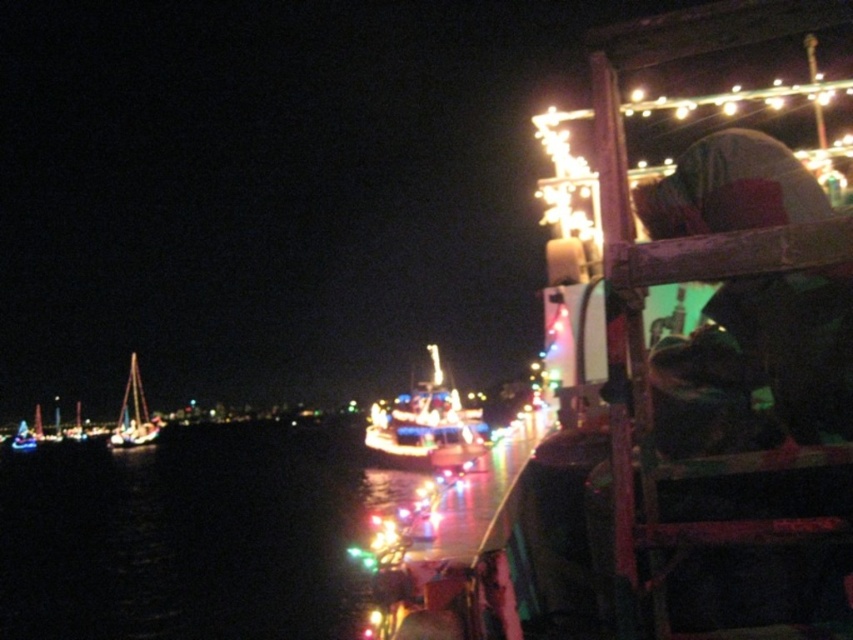
Looking at this image, you are standing at the point with coordinates point (132, 413). What object are you standing on?

You are standing on the shiny silver sailboat at left.

You are standing on the dock and looking out at the scene. Which object, the black water at center or the shiny blue boat at center, is closer to you?

The black water at center is closer to you because the shiny blue boat at center is positioned behind it.

Looking at this image, you are standing on the dock at the marina at night. You see a point marked at coordinates (186, 536). What is located at that point?

The point at coordinates (186, 536) marks black water at center.